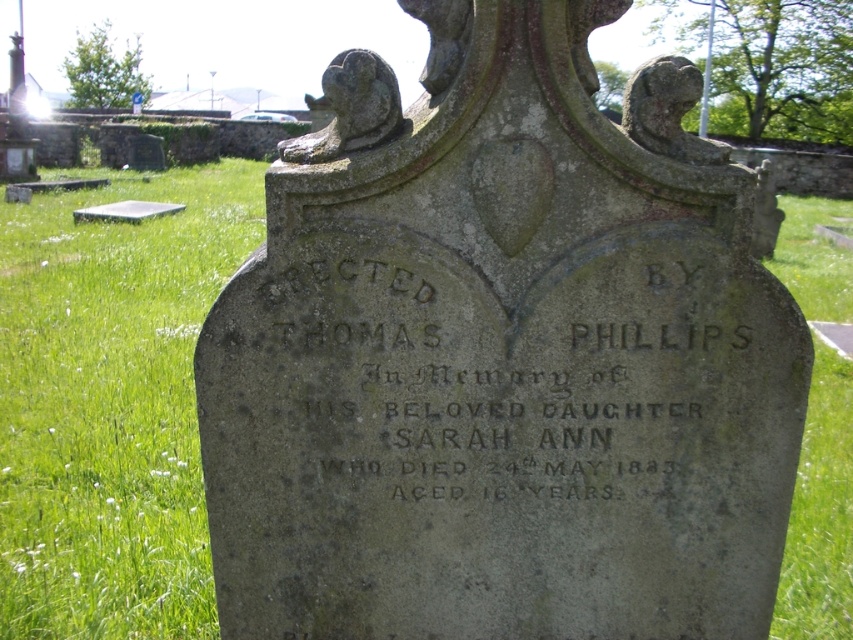
What are the coordinates of the gray stone monument at center in the image?

The gray stone monument at center is located at coordinates point (502, 358).

You are a historian examining the gray stone monument at center and the black stone inscription at center. Based on their sizes, which one is more likely to have been added later to the structure?

The black stone inscription at center is more likely to have been added later since it is much shorter than the gray stone monument at center, suggesting it was added after the main monument was already in place.